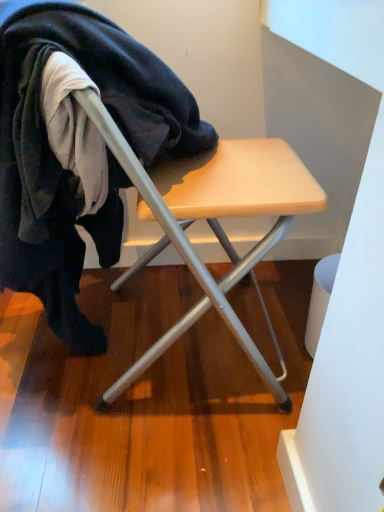
Describe the element at coordinates (213, 216) in the screenshot. The width and height of the screenshot is (384, 512). I see `wooden stool at center` at that location.

The width and height of the screenshot is (384, 512). What are the coordinates of `wooden stool at center` in the screenshot? It's located at (213, 216).

Find the location of a particular element. wooden stool at center is located at coordinates (213, 216).